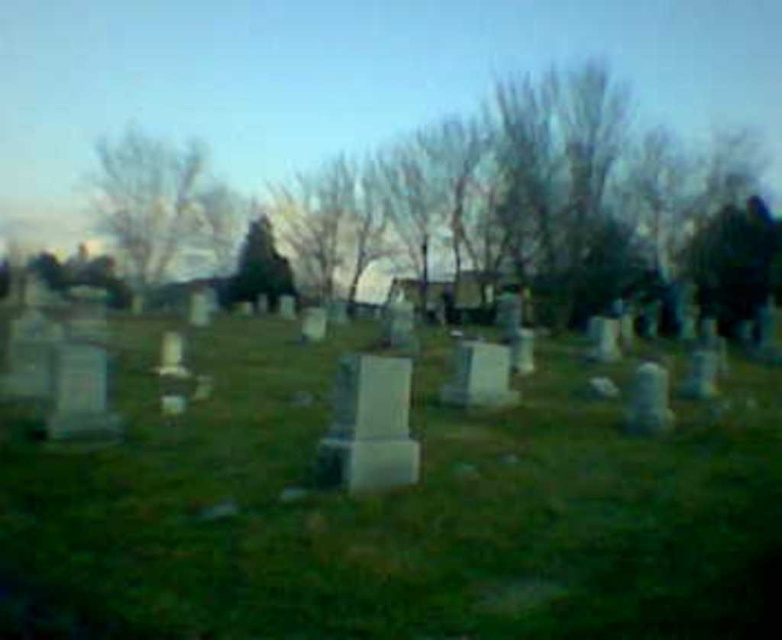
Between green grassy at center and white marble gravestone at center, which one has less height?

green grassy at center

Does green grassy at center have a lesser height compared to white marble gravestone at center?

Indeed, green grassy at center has a lesser height compared to white marble gravestone at center.

Where is `green grassy at center`? The height and width of the screenshot is (640, 782). green grassy at center is located at coordinates (404, 512).

Who is taller, white marble gravestone at center or smooth gray stone at lower right?

With more height is white marble gravestone at center.

Can you confirm if white marble gravestone at center is taller than smooth gray stone at lower right?

Indeed, white marble gravestone at center has a greater height compared to smooth gray stone at lower right.

What do you see at coordinates (368, 426) in the screenshot?
I see `white marble gravestone at center` at bounding box center [368, 426].

Where is `white marble gravestone at center`? The width and height of the screenshot is (782, 640). white marble gravestone at center is located at coordinates pyautogui.click(x=368, y=426).

Who is shorter, white stone gravestone at center or smooth gray gravestone at center-right?

With less height is white stone gravestone at center.

Find the location of a particular element. The width and height of the screenshot is (782, 640). white stone gravestone at center is located at coordinates (479, 376).